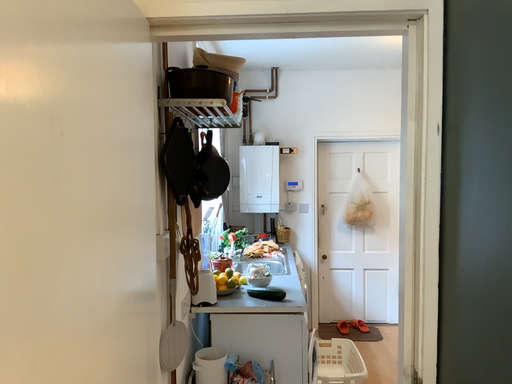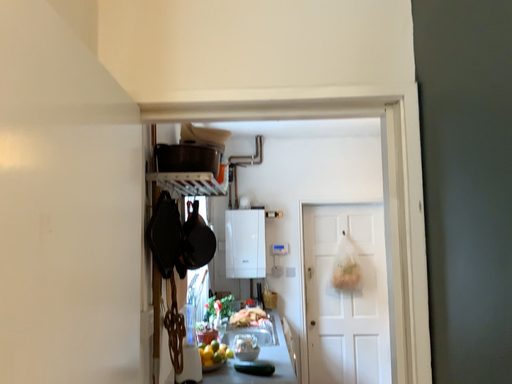
Question: Which way did the camera rotate in the video?

Choices:
 (A) rotated upward
 (B) rotated downward

Answer: (A)